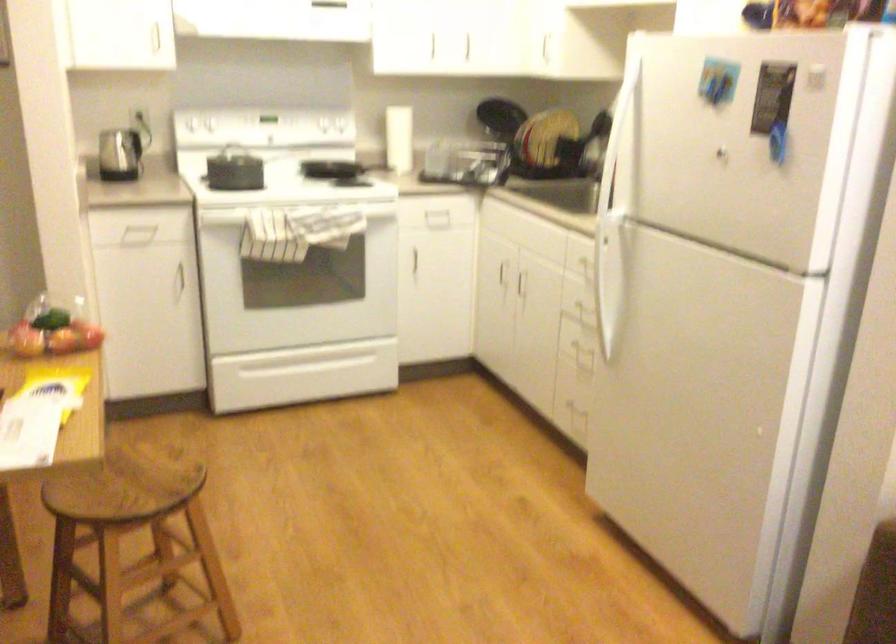
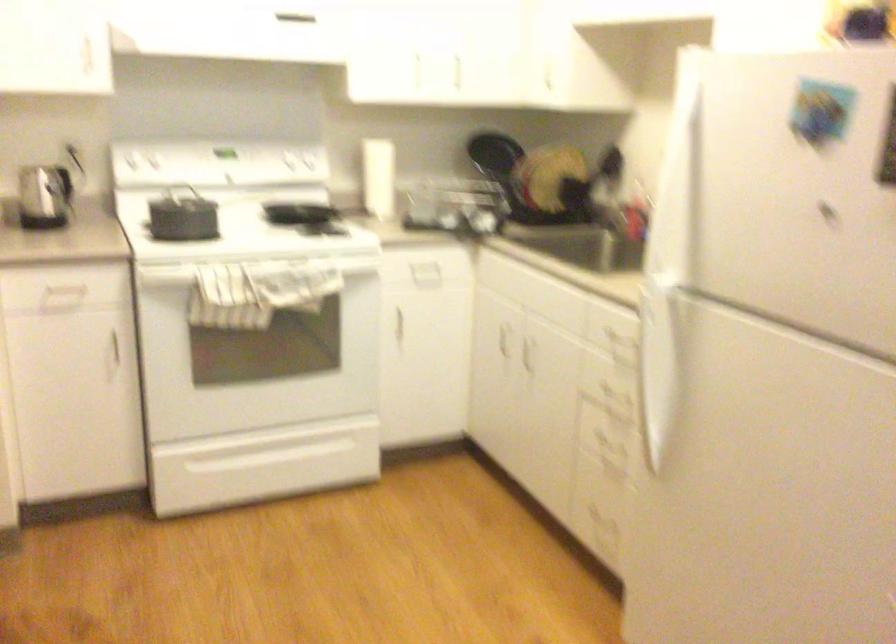
Locate, in the second image, the point that corresponds to point (303, 360) in the first image.

(263, 446)